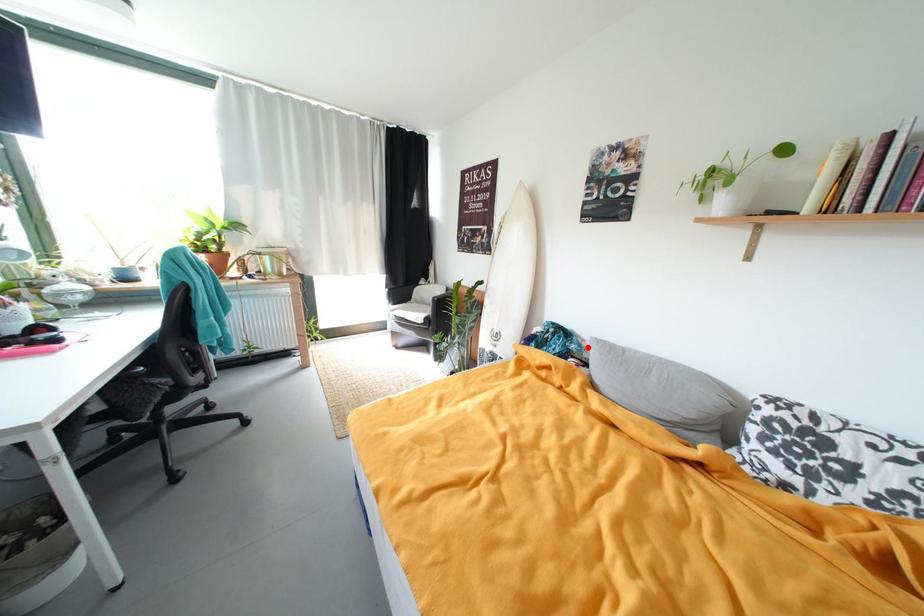
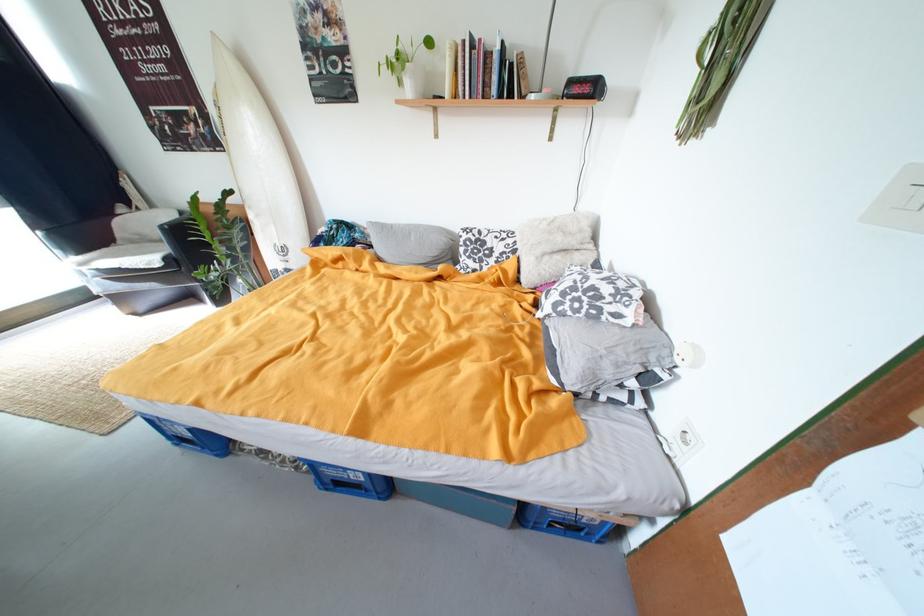
Question: I am providing you with two images of the same scene from different viewpoints. Given a red point in image1, look at the same physical point in image2. Is it:

Choices:
 (A) Closer to the viewpoint
 (B) Farther from the viewpoint

Answer: (A)